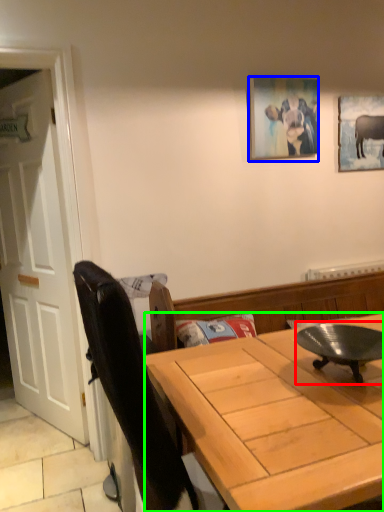
Question: Estimate the real-world distances between objects in this image. Which object is farther from round table (highlighted by a red box), picture frame (highlighted by a blue box) or desk (highlighted by a green box)?

Choices:
 (A) picture frame
 (B) desk

Answer: (A)